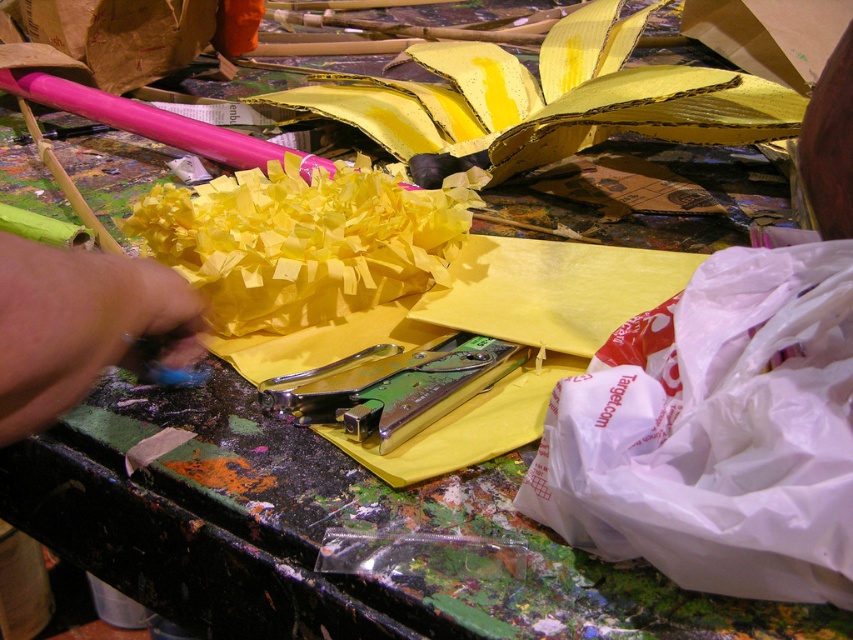
You are an artist working on a craft project. You need to reach for the metallic green stapler at center without disturbing the blue fabric hand at lower left. Is this possible?

The blue fabric hand at lower left is positioned over the metallic green stapler at center, so reaching for the metallic green stapler at center might disturb the blue fabric hand at lower left as it is covering it.

You are organizing the workspace and need to place the white plastic bag at lower right and the metallic green stapler at center into a drawer. The drawer has a width of 20 cm. Can both items fit side by side?

The white plastic bag at lower right is larger in size than the metallic green stapler at center. Since the drawer is 20 cm wide, it depends on the combined width of both items. However, without specific measurements, we cannot confirm if they will fit. Please measure both items to ensure they fit within the drawer space.

In the scene shown: You are organizing the workspace and need to place the blue fabric hand at lower left. Where should you position it relative to the yellow paper flower being crafted?

The blue fabric hand at lower left is located at point (80, 324), so it should be placed at the lower left position relative to the yellow paper flower being crafted.